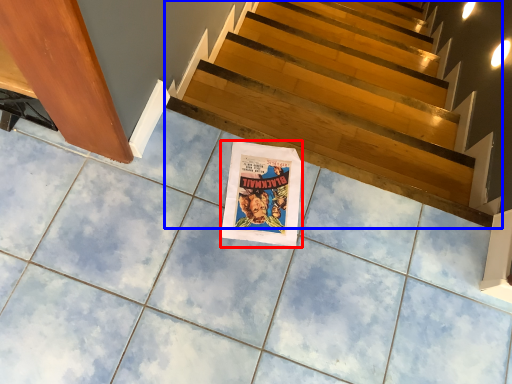
Question: Which object appears closest to the camera in this image, movie poster (highlighted by a red box) or stairs (highlighted by a blue box)?

Choices:
 (A) movie poster
 (B) stairs

Answer: (A)